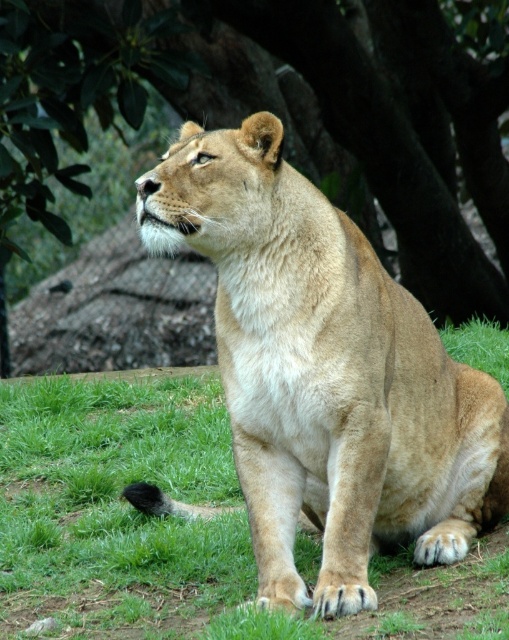
Looking at this image, who is more distant from viewer, (296, 509) or (438, 579)?

Positioned behind is point (438, 579).

Between golden fur lion at center and green grass at center, which one appears on the right side from the viewer's perspective?

From the viewer's perspective, golden fur lion at center appears more on the right side.

Is point (357, 372) positioned before point (180, 422)?

Yes, it is.

At what (x,y) coordinates should I click in order to perform the action: click on golden fur lion at center. Please return your answer as a coordinate pair (x, y). The height and width of the screenshot is (640, 509). Looking at the image, I should click on (325, 372).

Between point (39, 180) and point (206, 477), which one is positioned behind?

The point (39, 180) is behind.

Which of these two, green leafy tree at upper left or green grass at center, stands taller?

Standing taller between the two is green leafy tree at upper left.

Does point (18, 8) lie behind point (166, 540)?

Yes, it is.

At what (x,y) coordinates should I click in order to perform the action: click on green leafy tree at upper left. Please return your answer as a coordinate pair (x, y). Looking at the image, I should click on (290, 112).

Locate an element on the screen. The image size is (509, 640). green leafy tree at upper left is located at coordinates (290, 112).

Can you confirm if green leafy tree at upper left is positioned to the right of golden fur lion at center?

Incorrect, green leafy tree at upper left is not on the right side of golden fur lion at center.

Between point (112, 99) and point (418, 474), which one is positioned in front?

Positioned in front is point (418, 474).

Identify the location of green leafy tree at upper left. Image resolution: width=509 pixels, height=640 pixels. (290, 112).